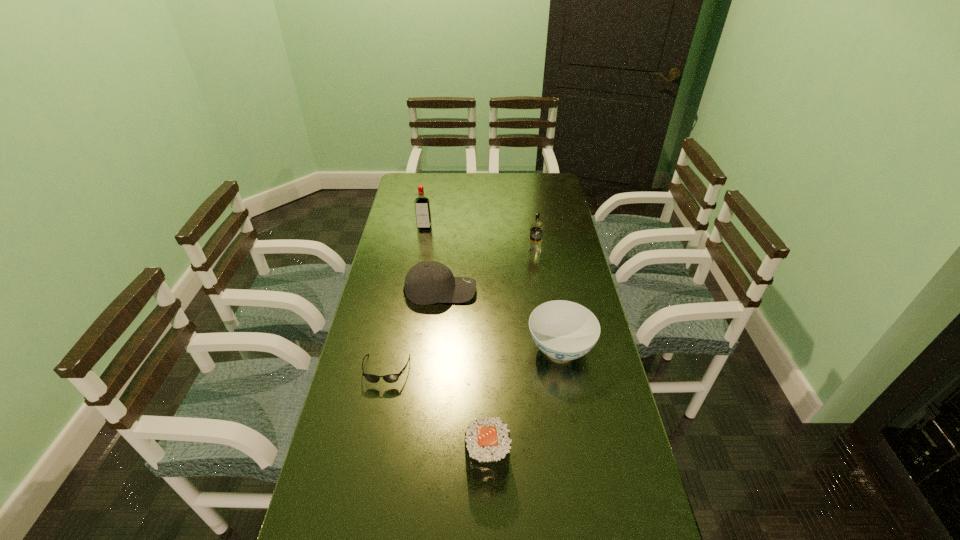
At what (x,y) coordinates should I click in order to perform the action: click on free space at the left edge. Please return your answer as a coordinate pair (x, y). The image size is (960, 540). Looking at the image, I should click on (394, 318).

In the image, there is a desktop. At what (x,y) coordinates should I click in order to perform the action: click on vacant region at the right edge. Please return your answer as a coordinate pair (x, y). This screenshot has width=960, height=540. Looking at the image, I should click on pos(606,420).

You are a GUI agent. You are given a task and a screenshot of the screen. Output one action in this format:
    pyautogui.click(x=<x>, y=<y>)
    Task: Click on the vacant space at the far left corner of the desktop
    The width and height of the screenshot is (960, 540).
    Given the screenshot: What is the action you would take?
    pyautogui.click(x=418, y=184)

You are a GUI agent. You are given a task and a screenshot of the screen. Output one action in this format:
    pyautogui.click(x=<x>, y=<y>)
    Task: Click on the free space between the sushi and the nearer vodka
    The width and height of the screenshot is (960, 540).
    Given the screenshot: What is the action you would take?
    pyautogui.click(x=511, y=355)

You are a GUI agent. You are given a task and a screenshot of the screen. Output one action in this format:
    pyautogui.click(x=<x>, y=<y>)
    Task: Click on the vacant area between the shortest object and the sushi
    
    Given the screenshot: What is the action you would take?
    pyautogui.click(x=437, y=415)

You are a GUI agent. You are given a task and a screenshot of the screen. Output one action in this format:
    pyautogui.click(x=<x>, y=<y>)
    Task: Click on the empty space between the sunglasses and the left vodka
    
    Given the screenshot: What is the action you would take?
    pyautogui.click(x=405, y=299)

Where is `empty location between the left vodka and the chinaware`? Image resolution: width=960 pixels, height=540 pixels. empty location between the left vodka and the chinaware is located at coordinates (492, 288).

Locate an element on the screen. vacant area that lies between the shortest object and the farthest object is located at coordinates (405, 299).

Find the location of `vacant space that is in between the nearer vodka and the nearest object`. vacant space that is in between the nearer vodka and the nearest object is located at coordinates (511, 355).

This screenshot has width=960, height=540. Identify the location of vacant point located between the chinaware and the shortest object. (473, 359).